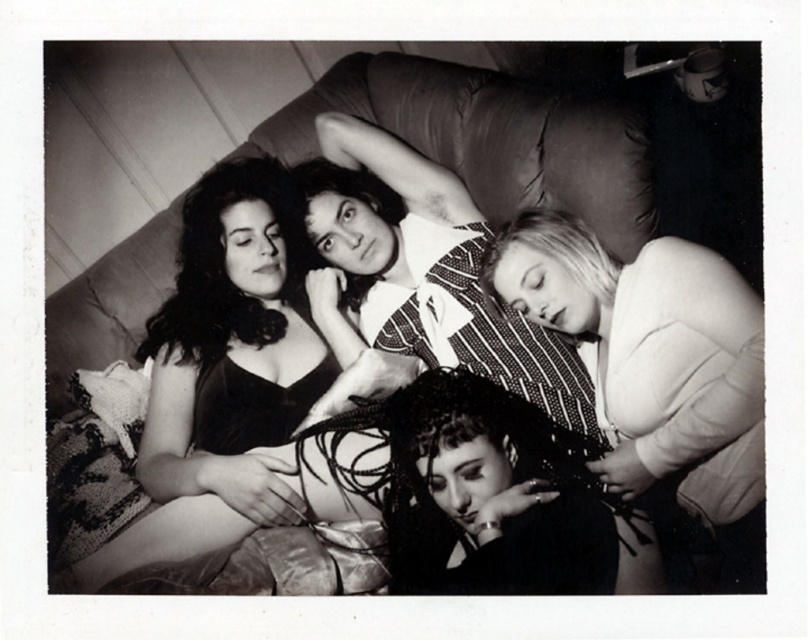
You are a photographer setting up for a group photo. You want to ensure that the leather couch at center and the striped fabric shirt at center are in focus simultaneously. Given that your camera can only maintain focus within a 12 inch range, will both objects be in focus?

The distance between the leather couch at center and the striped fabric shirt at center is 10.95 inches, which is within the 12 inch focus range. Therefore, both objects will be in focus.

You are standing in the living room where the photograph was taken. You want to place a small decorative item exactly halfway between the point at coordinates point [428,147] and the point at coordinates point [426,273]. Will the item be closer to the front or the back of the couch?

The item will be closer to the front of the couch because point [428,147] is further to the viewer than point [426,273], so the midpoint between them would still be closer to the front.

You are a photographer who wants to adjust the lighting to highlight both the matte black dress at upper left and the striped fabric shirt at center. Since the dress is on the left side of the shirt, where should you place the light source to ensure both items are well lit?

The matte black dress at upper left is positioned on the left side of striped fabric shirt at center. To ensure both items are well lit, place the light source to the right side of the setup so that it can illuminate both the dress and the shirt effectively.